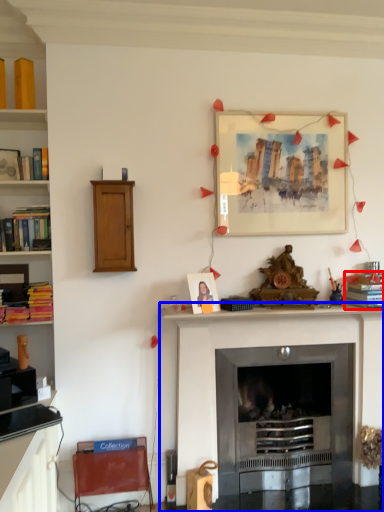
Question: Which of the following is the closest to the observer, book (highlighted by a red box) or fireplace (highlighted by a blue box)?

Choices:
 (A) book
 (B) fireplace

Answer: (B)